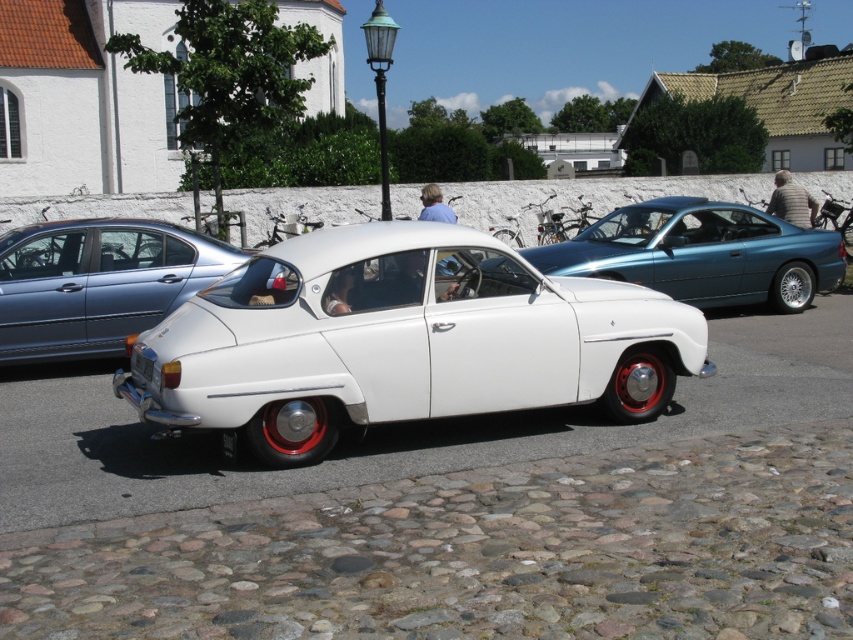
You need to determine if the white plastic license plate at center can fit into a space designed for the black plastic license plate at rear. Which license plate is wider?

The white plastic license plate at center might be wider than black plastic license plate at rear, so it may not fit into the space designed for the black plastic license plate at rear.

You are a delivery person trying to park a 15 feet long truck in the space between the white glossy car at center and the black plastic license plate at rear. Can the truck fit in that space?

The distance between the white glossy car at center and the black plastic license plate at rear is 4.80 feet. Since the truck is 15 feet long, it cannot fit in the space.